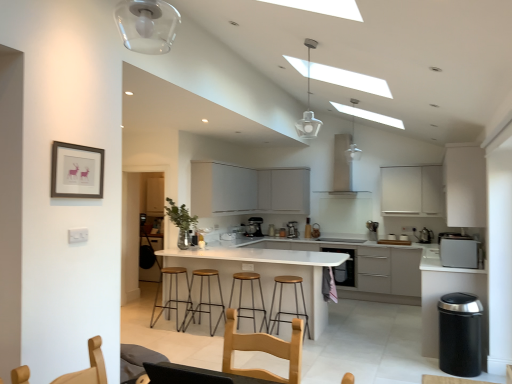
Describe the element at coordinates (372, 230) in the screenshot. I see `satin silver coffee machine at center, placed as the first coffee machine when sorted from right to left` at that location.

The image size is (512, 384). What do you see at coordinates (315, 231) in the screenshot?
I see `metallic silver toaster at center, the 2th appliance in the front-to-back sequence` at bounding box center [315, 231].

What do you see at coordinates (344, 267) in the screenshot?
I see `black matte dishwasher at center` at bounding box center [344, 267].

I want to click on black matte dishwasher at center, so click(x=344, y=267).

In order to face light brown wood swivel chair at lower left, the first swivel chair in the left-to-right sequence, should I rotate leftwards or rightwards?

You should rotate left by 25.353 degrees.

Identify the location of white matte cabinet at upper right, the fifth cabinetry when ordered from left to right. The image size is (512, 384). click(x=465, y=185).

This screenshot has width=512, height=384. What do you see at coordinates (308, 104) in the screenshot?
I see `clear glass pendant light at upper center, which is the 2th light fixture in right-to-left order` at bounding box center [308, 104].

Image resolution: width=512 pixels, height=384 pixels. In order to click on metallic silver toaster at center, the third appliance when ordered from right to left in this screenshot , I will do `click(308, 229)`.

Can you confirm if metallic silver toaster at center, the third appliance when ordered from right to left, is thinner than green glass vase at center?

Yes, metallic silver toaster at center, the third appliance when ordered from right to left, is thinner than green glass vase at center.

In terms of height, does metallic silver toaster at center, the 3th appliance positioned from the front, look taller or shorter compared to green glass vase at center?

Considering their sizes, metallic silver toaster at center, the 3th appliance positioned from the front, has less height than green glass vase at center.

Considering the sizes of objects metallic silver toaster at center, the 3th appliance positioned from the front, and green glass vase at center in the image provided, who is smaller, metallic silver toaster at center, the 3th appliance positioned from the front, or green glass vase at center?

metallic silver toaster at center, the 3th appliance positioned from the front, is smaller.

Does wooden seat bar stool at center, placed as the 4th bar stool when sorted from left to right, have a lesser height compared to matte glass pendant light at upper center, which is counted as the second light fixture, starting from the left?

Yes.

Is matte glass pendant light at upper center, positioned as the 1th light fixture in back-to-front order, surrounded by wooden seat bar stool at center, placed as the 4th bar stool when sorted from left to right?

No, matte glass pendant light at upper center, positioned as the 1th light fixture in back-to-front order, is not a part of wooden seat bar stool at center, placed as the 4th bar stool when sorted from left to right.

Identify the location of bar stool that is the 1st one when counting leftward from the matte glass pendant light at upper center, which is counted as the second light fixture, starting from the left. The height and width of the screenshot is (384, 512). (281, 304).

From the image's perspective, is wooden seat bar stool at center, the first bar stool when ordered from right to left, located above or below matte glass pendant light at upper center, marked as the 2th light fixture in a front-to-back arrangement?

From the image's perspective, wooden seat bar stool at center, the first bar stool when ordered from right to left, appears below matte glass pendant light at upper center, marked as the 2th light fixture in a front-to-back arrangement.

How different are the orientations of matte glass pendant light at upper center, which is counted as the second light fixture, starting from the left, and white matte countertop at center in degrees?

92.2 degrees separate the facing orientations of matte glass pendant light at upper center, which is counted as the second light fixture, starting from the left, and white matte countertop at center.

Image resolution: width=512 pixels, height=384 pixels. I want to click on countertop in front of the matte glass pendant light at upper center, positioned as the first light fixture in right-to-left order, so click(x=440, y=290).

Can you confirm if matte glass pendant light at upper center, positioned as the first light fixture in right-to-left order, is smaller than white matte countertop at center?

Indeed, matte glass pendant light at upper center, positioned as the first light fixture in right-to-left order, has a smaller size compared to white matte countertop at center.

From the picture: Between matte glass pendant light at upper center, marked as the 2th light fixture in a front-to-back arrangement, and white matte countertop at center, which one has more height?

white matte countertop at center.

Is green glass vase at center facing away from white matte cabinet at upper right, the first cabinetry positioned from the right?

No.

Between green glass vase at center and white matte cabinet at upper right, the first cabinetry positioned from the right, which one has smaller size?

Smaller between the two is green glass vase at center.

Which object is positioned more to the right, green glass vase at center or white matte cabinet at upper right, the first cabinetry positioned from the right?

Positioned to the right is white matte cabinet at upper right, the first cabinetry positioned from the right.

Which point is more forward, (191, 217) or (453, 214)?

Positioned in front is point (453, 214).

Who is more distant, metallic silver toaster at center, the 3th appliance positioned from the front, or satin silver microwave at right?

metallic silver toaster at center, the 3th appliance positioned from the front, is further from the camera.

Can you confirm if metallic silver toaster at center, positioned as the first appliance in left-to-right order, is wider than satin silver microwave at right?

No.

How distant is metallic silver toaster at center, positioned as the first appliance in left-to-right order, from satin silver microwave at right?

A distance of 3.39 meters exists between metallic silver toaster at center, positioned as the first appliance in left-to-right order, and satin silver microwave at right.

From a real-world perspective, between metallic silver toaster at center, the 3th appliance positioned from the front, and satin silver microwave at right, who is vertically lower?

From a 3D spatial view, satin silver microwave at right is below.

Does metallic silver toaster at center, which ranks as the 2th appliance in right-to-left order, lie behind black plastic trash can at lower right, the second cabinetry when ordered from right to left?

Yes, metallic silver toaster at center, which ranks as the 2th appliance in right-to-left order, is further from the viewer.

Is metallic silver toaster at center, which ranks as the 2th appliance in right-to-left order, not close to black plastic trash can at lower right, acting as the fourth cabinetry starting from the left?

Yes.

Which of these two, metallic silver toaster at center, which ranks as the 2th appliance in right-to-left order, or black plastic trash can at lower right, the second cabinetry when ordered from right to left, is thinner?

Result: metallic silver toaster at center, which ranks as the 2th appliance in right-to-left order.

In the scene shown: Is metallic silver toaster at center, the 2th appliance in the front-to-back sequence, at the left side of black plastic trash can at lower right, acting as the fourth cabinetry starting from the left?

Yes.

Is black matte dishwasher at center wider than matte black picture frame at upper left?

Yes.

What's the angular difference between black matte dishwasher at center and matte black picture frame at upper left's facing directions?

The angle between the facing direction of black matte dishwasher at center and the facing direction of matte black picture frame at upper left is 90.3 degrees.

Could you tell me if black matte dishwasher at center is turned towards matte black picture frame at upper left?

Yes, black matte dishwasher at center is turned towards matte black picture frame at upper left.

Does black matte dishwasher at center have a greater height compared to matte black picture frame at upper left?

Correct, black matte dishwasher at center is much taller as matte black picture frame at upper left.

At what (x,y) coordinates should I click in order to perform the action: click on plant in front of the metallic silver toaster at center, positioned as the first appliance in back-to-front order. Please return your answer as a coordinate pair (x, y). This screenshot has height=384, width=512. Looking at the image, I should click on (181, 222).

You are a GUI agent. You are given a task and a screenshot of the screen. Output one action in this format:
    pyautogui.click(x=<x>, y=<y>)
    Task: Click on the bar stool that is the 4th one below the matte glass pendant light at upper center, positioned as the first light fixture in right-to-left order (from a real-world perspective)
    The image size is (512, 384).
    Given the screenshot: What is the action you would take?
    pyautogui.click(x=281, y=304)

Which object lies nearer to the anchor point white glossy table at center, white matte cabinet at upper center, which is the fifth cabinetry from right to left, or white matte countertop at center?

white matte countertop at center.

Estimate the real-world distances between objects in this image. Which object is further from black matte dishwasher at center, white glossy table at center or white matte cabinet at upper right, which ranks as the 3th cabinetry in left-to-right order?

white glossy table at center.

Consider the image. From the image, which object appears to be nearer to satin silver microwave at right, black plastic trash can at lower right, the second cabinetry when ordered from right to left, or white matte countertop at center?

Among the two, black plastic trash can at lower right, the second cabinetry when ordered from right to left, is located nearer to satin silver microwave at right.

Looking at the image, which one is located closer to black plastic trash can at lower right, the second cabinetry when ordered from right to left, wooden seat bar stool at center, the first bar stool when ordered from right to left, or metallic silver toaster at center, the third appliance when ordered from right to left?

The object closer to black plastic trash can at lower right, the second cabinetry when ordered from right to left, is wooden seat bar stool at center, the first bar stool when ordered from right to left.

When comparing their distances from white matte cabinet at upper right, which ranks as the 3th cabinetry in left-to-right order, does white matte cabinet at center, the 2th cabinetry from the left, or black matte dishwasher at center seem closer?

black matte dishwasher at center is positioned closer to the anchor white matte cabinet at upper right, which ranks as the 3th cabinetry in left-to-right order.

Based on their spatial positions, is clear glass pendant light at upper center, which is the 2th light fixture in right-to-left order, or white glossy table at center further from satin silver coffee machine at center, the 3th coffee machine positioned from the back?

white glossy table at center is positioned further to the anchor satin silver coffee machine at center, the 3th coffee machine positioned from the back.

Which object lies further to the anchor point clear glass pendant light at upper center, the 1th light fixture viewed from the front, metallic silver toaster at center, the third appliance when ordered from right to left, or light wood swivel chair at center, which is the 1th swivel chair from right to left?

light wood swivel chair at center, which is the 1th swivel chair from right to left, is further to clear glass pendant light at upper center, the 1th light fixture viewed from the front.

When comparing their distances from wooden seat bar stool at center, the first bar stool when ordered from right to left, does metallic silver toaster at center, which ranks as the 2th appliance in right-to-left order, or light brown wood swivel chair at lower left, the first swivel chair in the left-to-right sequence, seem further?

Based on the image, light brown wood swivel chair at lower left, the first swivel chair in the left-to-right sequence, appears to be further to wooden seat bar stool at center, the first bar stool when ordered from right to left.

The width and height of the screenshot is (512, 384). In order to click on dish washer between white matte cabinet at upper center, which ranks as the first cabinetry in left-to-right order, and white matte cabinet at center, the 2th cabinetry from the left, in the front-back direction in this screenshot , I will do `click(344, 267)`.

At what (x,y) coordinates should I click in order to perform the action: click on table between green glass vase at center and white matte countertop at center. Please return your answer as a coordinate pair (x, y). Looking at the image, I should click on (265, 271).

The width and height of the screenshot is (512, 384). Find the location of `appliance located between satin silver coffee machine at center, which is counted as the third coffee machine, starting from the right, and metallic silver toaster at center, the 2th appliance in the front-to-back sequence, in the left-right direction`. appliance located between satin silver coffee machine at center, which is counted as the third coffee machine, starting from the right, and metallic silver toaster at center, the 2th appliance in the front-to-back sequence, in the left-right direction is located at coordinates (308, 229).

Find the location of `exhaust hood between wooden seat bar stool at center, placed as the 2th bar stool when sorted from left to right, and black plastic trash can at lower right, the second cabinetry when ordered from right to left, from left to right`. exhaust hood between wooden seat bar stool at center, placed as the 2th bar stool when sorted from left to right, and black plastic trash can at lower right, the second cabinetry when ordered from right to left, from left to right is located at coordinates (344, 163).